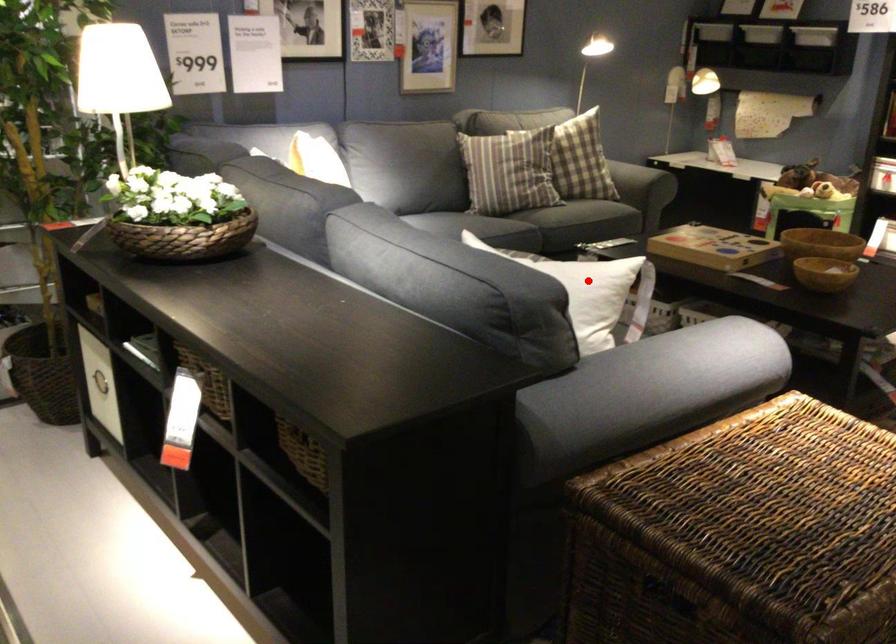
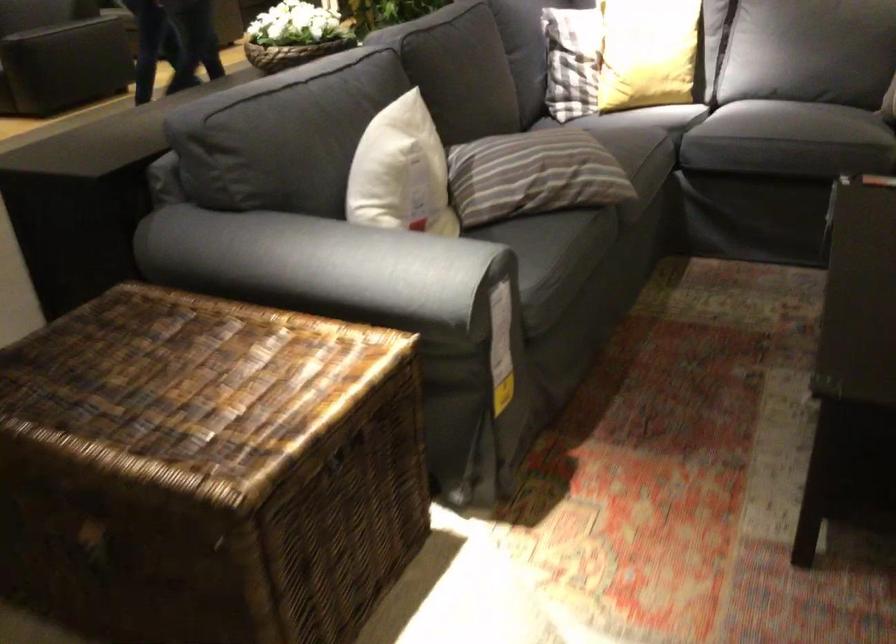
Locate, in the second image, the point that corresponds to the highlighted location in the first image.

(401, 172)